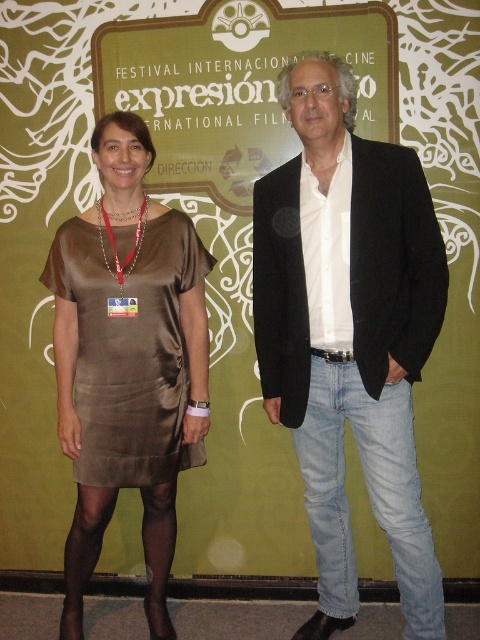
Question: Which of the following is the farthest from the observer?

Choices:
 (A) black cotton blazer at center
 (B) light blue denim jeans at lower right
 (C) satin dress at left

Answer: (C)

Question: Does black cotton blazer at center have a smaller size compared to satin dress at left?

Choices:
 (A) no
 (B) yes

Answer: (A)

Question: Which of the following is the closest to the observer?

Choices:
 (A) black cotton blazer at center
 (B) light blue denim jeans at lower right
 (C) satin dress at left

Answer: (A)

Question: Which point is farther to the camera?

Choices:
 (A) (428, 528)
 (B) (310, 97)
 (C) (115, 321)

Answer: (C)

Question: Is satin dress at left to the left of light blue denim jeans at lower right from the viewer's perspective?

Choices:
 (A) yes
 (B) no

Answer: (A)

Question: Is black cotton blazer at center behind satin dress at left?

Choices:
 (A) yes
 (B) no

Answer: (B)